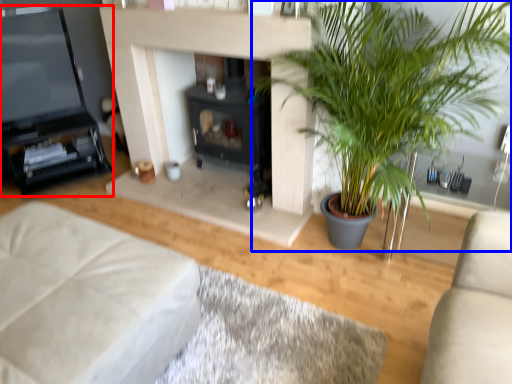
Question: Among these objects, which one is nearest to the camera, entertainment center (highlighted by a red box) or houseplant (highlighted by a blue box)?

Choices:
 (A) entertainment center
 (B) houseplant

Answer: (B)